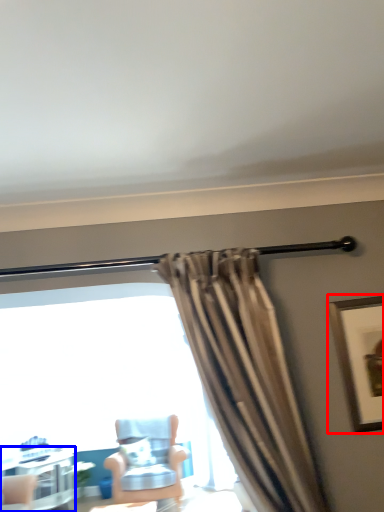
Question: Which object appears closest to the camera in this image, picture frame (highlighted by a red box) or table (highlighted by a blue box)?

Choices:
 (A) picture frame
 (B) table

Answer: (A)